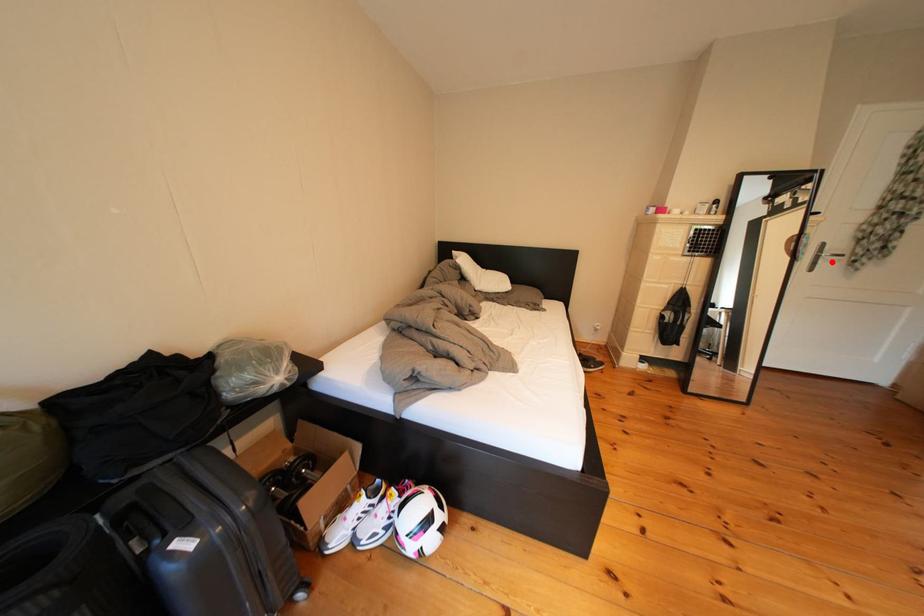
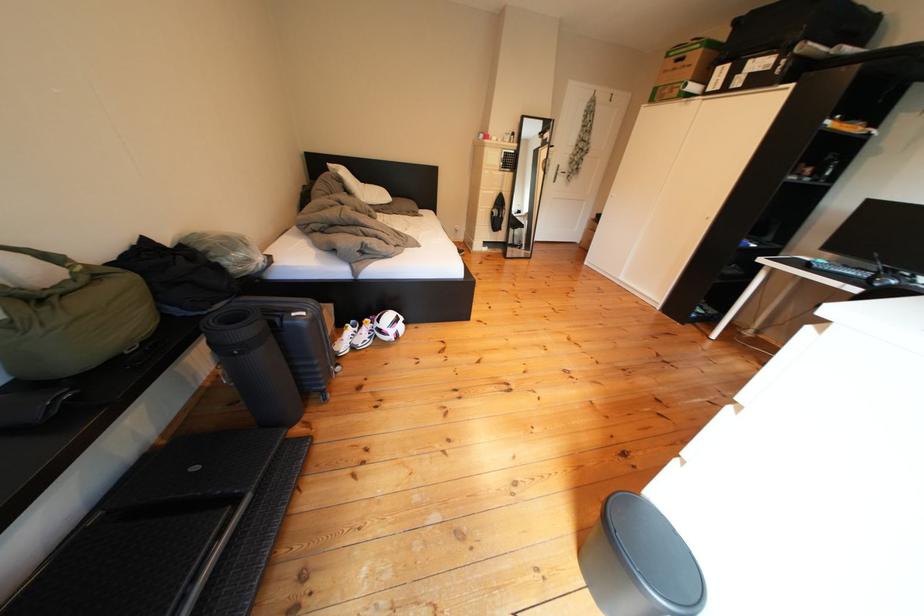
Where in the second image is the point corresponding to the highlighted location from the first image?

(570, 179)